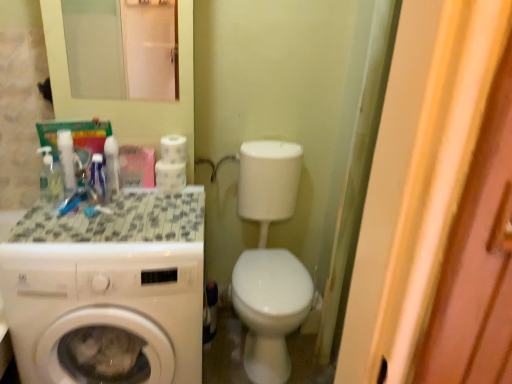
Question: Is white glossy mouthwash at left, which is the second mouthwash in left-to-right order, taller than tile mosaic countertop at left?

Choices:
 (A) yes
 (B) no

Answer: (A)

Question: Is white glossy mouthwash at left, placed as the 2th mouthwash when sorted from right to left, bigger than tile mosaic countertop at left?

Choices:
 (A) no
 (B) yes

Answer: (A)

Question: Considering the relative sizes of white glossy mouthwash at left, placed as the 2th mouthwash when sorted from right to left, and tile mosaic countertop at left in the image provided, is white glossy mouthwash at left, placed as the 2th mouthwash when sorted from right to left, thinner than tile mosaic countertop at left?

Choices:
 (A) no
 (B) yes

Answer: (B)

Question: Considering the relative positions of white glossy mouthwash at left, placed as the 2th mouthwash when sorted from right to left, and tile mosaic countertop at left in the image provided, is white glossy mouthwash at left, placed as the 2th mouthwash when sorted from right to left, to the left of tile mosaic countertop at left from the viewer's perspective?

Choices:
 (A) yes
 (B) no

Answer: (A)

Question: Is white glossy mouthwash at left, which is the second mouthwash in left-to-right order, facing away from tile mosaic countertop at left?

Choices:
 (A) yes
 (B) no

Answer: (B)

Question: From the image's perspective, is white glossy mouthwash at left, placed as the 2th mouthwash when sorted from right to left, over tile mosaic countertop at left?

Choices:
 (A) no
 (B) yes

Answer: (B)

Question: Can you confirm if white glossy mouthwash at left, which is the second mouthwash in left-to-right order, is wider than clear plastic mouthwash at upper left, arranged as the third mouthwash when viewed from the right?

Choices:
 (A) no
 (B) yes

Answer: (A)

Question: Is white glossy mouthwash at left, which is the second mouthwash in left-to-right order, behind clear plastic mouthwash at upper left, the first mouthwash from the left?

Choices:
 (A) yes
 (B) no

Answer: (A)

Question: Is white glossy mouthwash at left, placed as the 2th mouthwash when sorted from right to left, positioned in front of clear plastic mouthwash at upper left, arranged as the third mouthwash when viewed from the right?

Choices:
 (A) no
 (B) yes

Answer: (A)

Question: Are white glossy mouthwash at left, placed as the 2th mouthwash when sorted from right to left, and clear plastic mouthwash at upper left, the first mouthwash from the left, located far from each other?

Choices:
 (A) no
 (B) yes

Answer: (A)

Question: Is white glossy mouthwash at left, placed as the 2th mouthwash when sorted from right to left, facing towards clear plastic mouthwash at upper left, arranged as the third mouthwash when viewed from the right?

Choices:
 (A) no
 (B) yes

Answer: (A)

Question: From a real-world perspective, is white glossy mouthwash at left, placed as the 2th mouthwash when sorted from right to left, beneath clear plastic mouthwash at upper left, arranged as the third mouthwash when viewed from the right?

Choices:
 (A) no
 (B) yes

Answer: (A)

Question: Is white glossy washing machine at left thinner than white glossy mouthwash at upper left, which is the third mouthwash from left to right?

Choices:
 (A) yes
 (B) no

Answer: (B)